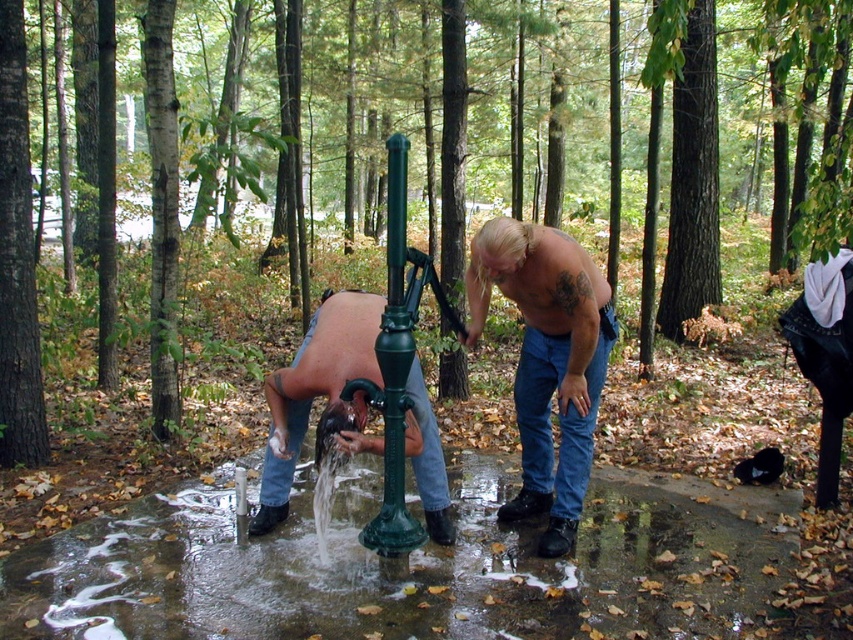
Who is positioned more to the left, wet concrete puddle at lower center or shiny metallic faucet at center?

Positioned to the left is shiny metallic faucet at center.

Does wet concrete puddle at lower center have a greater height compared to shiny metallic faucet at center?

No, wet concrete puddle at lower center is not taller than shiny metallic faucet at center.

You are a GUI agent. You are given a task and a screenshot of the screen. Output one action in this format:
    pyautogui.click(x=<x>, y=<y>)
    Task: Click on the wet concrete puddle at lower center
    Image resolution: width=853 pixels, height=640 pixels.
    Given the screenshot: What is the action you would take?
    pyautogui.click(x=408, y=566)

This screenshot has height=640, width=853. Identify the location of wet concrete puddle at lower center. (408, 566).

Is shiny blue jeans at center wider than shiny metallic faucet at center?

Incorrect, shiny blue jeans at center's width does not surpass shiny metallic faucet at center's.

Is point (529, 490) farther from viewer compared to point (322, 337)?

Yes, point (529, 490) is farther from viewer.

The image size is (853, 640). What are the coordinates of `shiny blue jeans at center` in the screenshot? It's located at (547, 360).

Consider the image. Does wet concrete puddle at lower center have a lesser height compared to shiny blue jeans at center?

Yes, wet concrete puddle at lower center is shorter than shiny blue jeans at center.

Is point (288, 516) farther from camera compared to point (548, 227)?

Yes, it is.

Locate an element on the screen. This screenshot has height=640, width=853. wet concrete puddle at lower center is located at coordinates (408, 566).